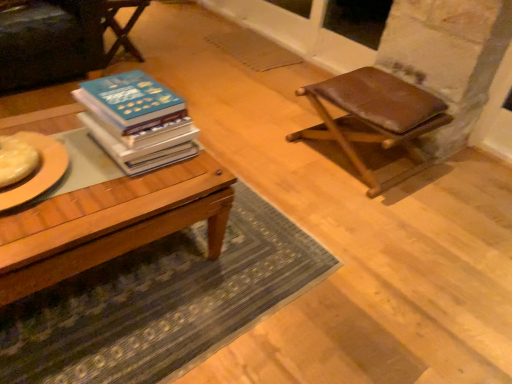
I want to click on brown leather stool at right, so click(375, 117).

Measure the distance between point (155, 356) and camera.

A distance of 4.26 feet exists between point (155, 356) and camera.

Describe the element at coordinates (122, 27) in the screenshot. I see `wooden chair at upper left` at that location.

Find the location of a particular element. brown leather stool at right is located at coordinates (375, 117).

Which is in front, brown leather stool at right or green textured rug at lower center?

green textured rug at lower center is closer to the camera.

From the picture: Is brown leather stool at right with green textured rug at lower center?

No, brown leather stool at right is not making contact with green textured rug at lower center.

Is point (414, 85) closer to camera compared to point (229, 302)?

No, (414, 85) is behind (229, 302).

Looking at the image, does brown leather stool at right seem bigger or smaller compared to green textured rug at lower center?

In the image, brown leather stool at right appears to be larger than green textured rug at lower center.

In the scene shown: Which of these two, wooden table at center or hardcover books at center, stands taller?

wooden table at center is taller.

Can you confirm if wooden table at center is bigger than hardcover books at center?

Yes.

Is wooden table at center further to camera compared to wooden chair at upper left?

That is False.

At what (x,y) coordinates should I click in order to perform the action: click on table below the wooden chair at upper left (from a real-world perspective). Please return your answer as a coordinate pair (x, y). Looking at the image, I should click on (110, 223).

From the image's perspective, between wooden table at center and wooden chair at upper left, which one is located above?

wooden chair at upper left.

Looking at this image, considering the sizes of wooden table at center and wooden chair at upper left in the image, is wooden table at center wider or thinner than wooden chair at upper left?

Clearly, wooden table at center has more width compared to wooden chair at upper left.

Based on the photo, is green textured rug at lower center at the back of wooden table at center?

wooden table at center does not have its back to green textured rug at lower center.

From the image's perspective, which one is positioned higher, wooden table at center or green textured rug at lower center?

wooden table at center, from the image's perspective.

Find the location of a particular element. The width and height of the screenshot is (512, 384). mat on the right of wooden table at center is located at coordinates (161, 303).

Do you think wooden table at center is within green textured rug at lower center, or outside of it?

wooden table at center is outside green textured rug at lower center.

At what (x,y) coordinates should I click in order to perform the action: click on stool that is under the hardcover books at center (from a real-world perspective). Please return your answer as a coordinate pair (x, y). The height and width of the screenshot is (384, 512). Looking at the image, I should click on [375, 117].

Based on their sizes in the image, would you say brown leather stool at right is bigger or smaller than hardcover books at center?

Considering their sizes, brown leather stool at right takes up more space than hardcover books at center.

What's the angular difference between brown leather stool at right and hardcover books at center's facing directions?

brown leather stool at right and hardcover books at center are facing 89.9 degrees away from each other.

Is brown leather stool at right taller than hardcover books at center?

Yes.

Is wooden chair at upper left oriented towards hardcover books at center?

Yes, wooden chair at upper left faces towards hardcover books at center.

Choose the correct answer: Is wooden chair at upper left inside hardcover books at center or outside it?

wooden chair at upper left exists outside the volume of hardcover books at center.

From a real-world perspective, which is physically above, wooden chair at upper left or hardcover books at center?

In real-world perspective, hardcover books at center is above.

The height and width of the screenshot is (384, 512). In order to click on book that is above the green textured rug at lower center (from a real-world perspective) in this screenshot , I will do `click(137, 121)`.

What's the angular difference between hardcover books at center and green textured rug at lower center's facing directions?

They differ by 0.000645 degrees in their facing directions.

Based on the photo, from the image's perspective, is hardcover books at center beneath green textured rug at lower center?

No, from the image's perspective, hardcover books at center is not beneath green textured rug at lower center.

Considering the relative sizes of hardcover books at center and green textured rug at lower center in the image provided, is hardcover books at center thinner than green textured rug at lower center?

Yes.

You are a GUI agent. You are given a task and a screenshot of the screen. Output one action in this format:
    pyautogui.click(x=<x>, y=<y>)
    Task: Click on the stool above the green textured rug at lower center (from a real-world perspective)
    This screenshot has height=384, width=512.
    Given the screenshot: What is the action you would take?
    pyautogui.click(x=375, y=117)

This screenshot has height=384, width=512. I want to click on book located above the wooden table at center (from the image's perspective), so click(137, 121).

Considering their positions, is green textured rug at lower center positioned closer to wooden table at center than wooden chair at upper left?

The object closer to wooden table at center is green textured rug at lower center.

Considering their positions, is wooden chair at upper left positioned closer to brown leather stool at right than wooden table at center?

wooden table at center is closer to brown leather stool at right.

When comparing their distances from wooden chair at upper left, does green textured rug at lower center or wooden table at center seem closer?

The object closer to wooden chair at upper left is wooden table at center.

Which object lies further to the anchor point hardcover books at center, wooden table at center or green textured rug at lower center?

green textured rug at lower center is positioned further to the anchor hardcover books at center.

When comparing their distances from wooden table at center, does brown leather stool at right or green textured rug at lower center seem closer?

Among the two, green textured rug at lower center is located nearer to wooden table at center.

Considering their positions, is brown leather stool at right positioned closer to green textured rug at lower center than wooden table at center?

Among the two, wooden table at center is located nearer to green textured rug at lower center.

Which object lies further to the anchor point wooden chair at upper left, brown leather stool at right or wooden table at center?

Among the two, wooden table at center is located further to wooden chair at upper left.

Considering their positions, is wooden chair at upper left positioned further to green textured rug at lower center than wooden table at center?

wooden chair at upper left is further to green textured rug at lower center.

Where is `book between wooden chair at upper left and brown leather stool at right in the horizontal direction`? The image size is (512, 384). book between wooden chair at upper left and brown leather stool at right in the horizontal direction is located at coordinates (137, 121).

The image size is (512, 384). Find the location of `book between green textured rug at lower center and brown leather stool at right from left to right`. book between green textured rug at lower center and brown leather stool at right from left to right is located at coordinates (137, 121).

Where is `book between wooden table at center and wooden chair at upper left along the z-axis`? Image resolution: width=512 pixels, height=384 pixels. book between wooden table at center and wooden chair at upper left along the z-axis is located at coordinates (137, 121).

The height and width of the screenshot is (384, 512). Find the location of `mat between wooden table at center and brown leather stool at right`. mat between wooden table at center and brown leather stool at right is located at coordinates (161, 303).